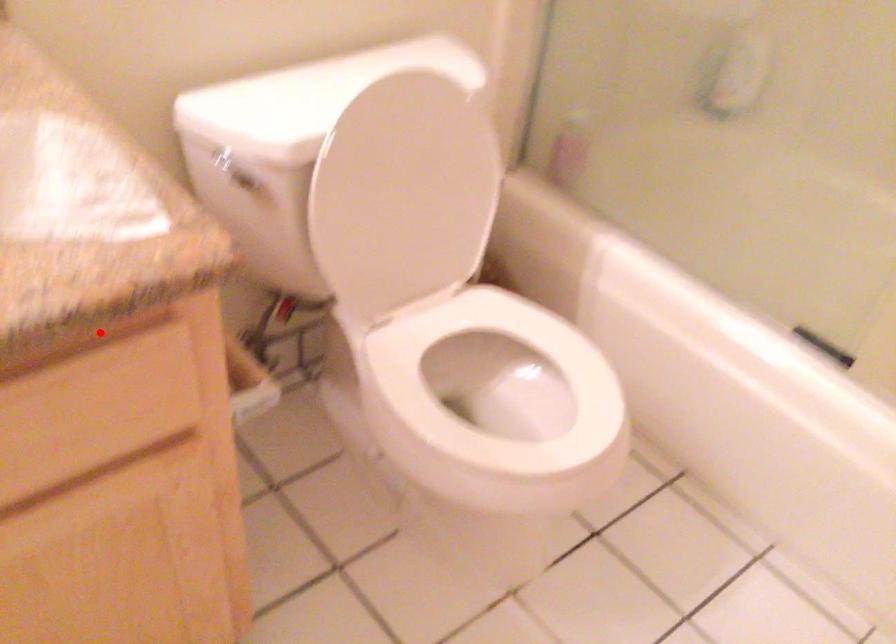
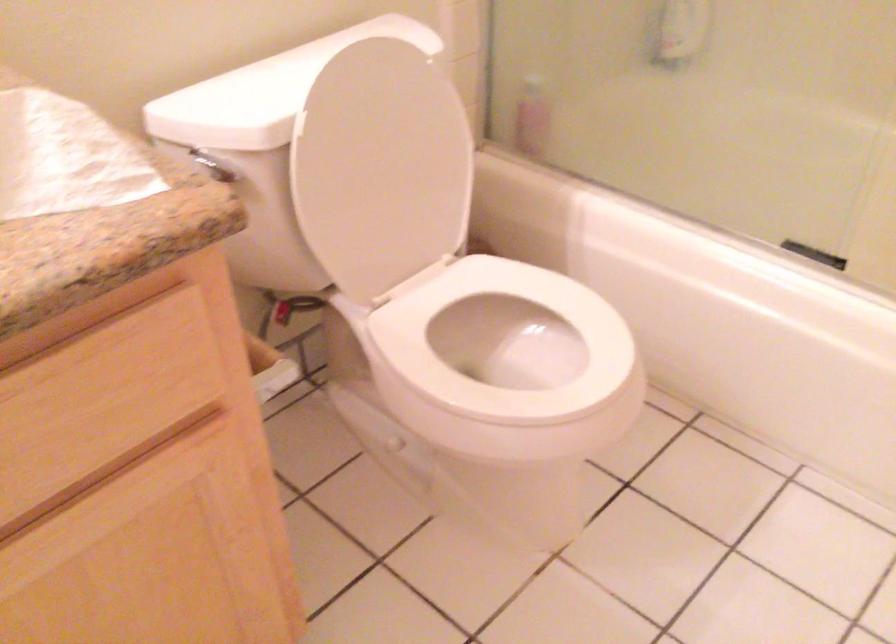
The point at the highlighted location is marked in the first image. Where is the corresponding point in the second image?

(117, 303)